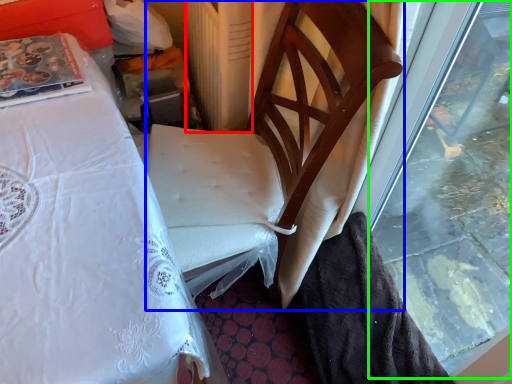
Question: Which object is positioned farthest from radiator (highlighted by a red box)? Select from chair (highlighted by a blue box) and window (highlighted by a green box).

Choices:
 (A) chair
 (B) window

Answer: (B)